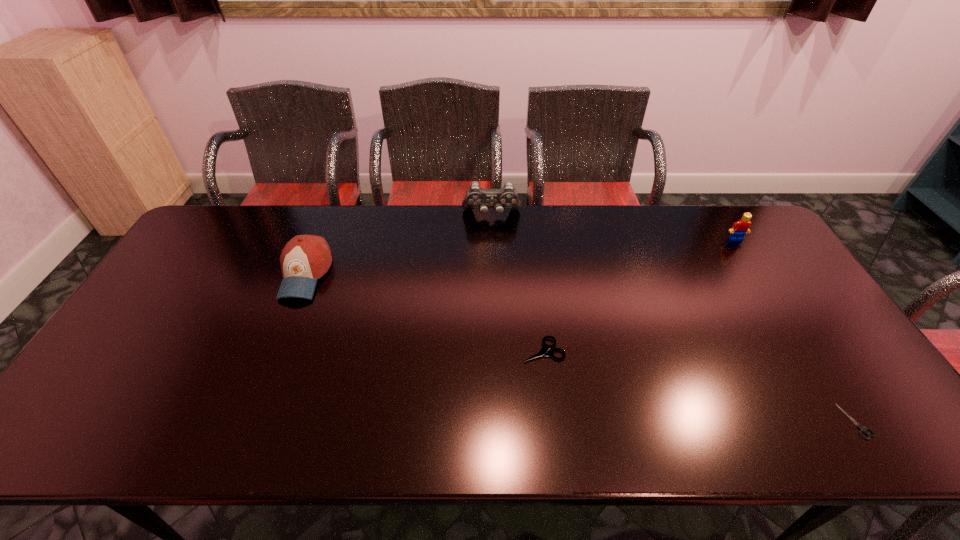
Find the location of a particular element. This screenshot has height=540, width=960. vacant space located 0.310m on the front-facing side of the fourth nearest object is located at coordinates (782, 313).

This screenshot has height=540, width=960. In order to click on vacant space located on the front-facing side of the third farthest object in this screenshot , I will do `click(279, 340)`.

At what (x,y) coordinates should I click in order to perform the action: click on vacant space situated on the left of the left shears. Please return your answer as a coordinate pair (x, y). Looking at the image, I should click on (459, 350).

The image size is (960, 540). What are the coordinates of `blank area located on the back of the nearer shears` in the screenshot? It's located at (799, 333).

Find the location of a particular element. control present at the far edge is located at coordinates (476, 197).

Locate an element on the screen. This screenshot has width=960, height=540. Lego positioned at the far edge is located at coordinates (739, 229).

Where is `baseball cap that is at the far edge`? This screenshot has width=960, height=540. baseball cap that is at the far edge is located at coordinates (305, 258).

The image size is (960, 540). Find the location of `object that is at the near edge`. object that is at the near edge is located at coordinates (862, 429).

Where is `Lego at the right edge`? Lego at the right edge is located at coordinates (739, 229).

At what (x,y) coordinates should I click in order to perform the action: click on shears that is at the right edge. Please return your answer as a coordinate pair (x, y). This screenshot has height=540, width=960. Looking at the image, I should click on (862, 429).